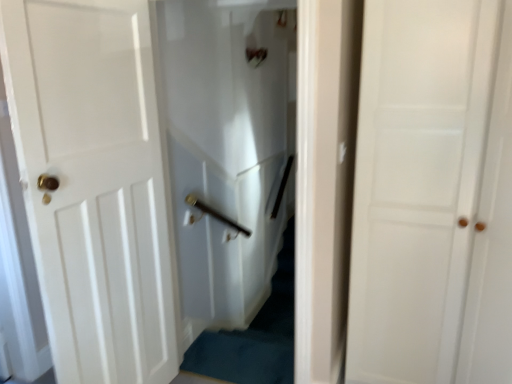
Question: From a real-world perspective, is white glossy elevator at center over white matte door at center, the 1th door in the right-to-left sequence?

Choices:
 (A) yes
 (B) no

Answer: (B)

Question: Is white glossy elevator at center facing away from white matte door at center, the 1th door in the right-to-left sequence?

Choices:
 (A) no
 (B) yes

Answer: (A)

Question: Are white glossy elevator at center and white matte door at center, the 1th door in the right-to-left sequence, far apart?

Choices:
 (A) no
 (B) yes

Answer: (B)

Question: Is white glossy elevator at center thinner than white matte door at center, which appears as the second door when viewed from the left?

Choices:
 (A) no
 (B) yes

Answer: (B)

Question: From a real-world perspective, is white glossy elevator at center located beneath white matte door at center, the 1th door in the right-to-left sequence?

Choices:
 (A) yes
 (B) no

Answer: (A)

Question: Is white matte door at center, the 1th door in the right-to-left sequence, in front of or behind white glossy elevator at center in the image?

Choices:
 (A) behind
 (B) front

Answer: (B)

Question: In terms of height, does white matte door at center, the 1th door in the right-to-left sequence, look taller or shorter compared to white glossy elevator at center?

Choices:
 (A) tall
 (B) short

Answer: (A)

Question: Is point (385, 223) closer or farther from the camera than point (292, 16)?

Choices:
 (A) farther
 (B) closer

Answer: (B)

Question: In terms of width, does white matte door at center, which appears as the second door when viewed from the left, look wider or thinner when compared to white glossy elevator at center?

Choices:
 (A) wide
 (B) thin

Answer: (A)

Question: From the image's perspective, is white glossy door at left, the 2th door positioned from the right, positioned above or below white glossy elevator at center?

Choices:
 (A) above
 (B) below

Answer: (B)

Question: Do you think white glossy door at left, which appears as the 1th door when viewed from the left, is within white glossy elevator at center, or outside of it?

Choices:
 (A) outside
 (B) inside

Answer: (A)

Question: From a real-world perspective, is white glossy door at left, which appears as the 1th door when viewed from the left, above or below white glossy elevator at center?

Choices:
 (A) below
 (B) above

Answer: (A)

Question: From their relative heights in the image, would you say white glossy door at left, the 2th door positioned from the right, is taller or shorter than white glossy elevator at center?

Choices:
 (A) tall
 (B) short

Answer: (A)

Question: Is white glossy door at left, which appears as the 1th door when viewed from the left, wider or thinner than white matte door at center, which appears as the second door when viewed from the left?

Choices:
 (A) thin
 (B) wide

Answer: (A)

Question: Looking at the image, does white glossy door at left, the 2th door positioned from the right, seem bigger or smaller compared to white matte door at center, which appears as the second door when viewed from the left?

Choices:
 (A) small
 (B) big

Answer: (A)